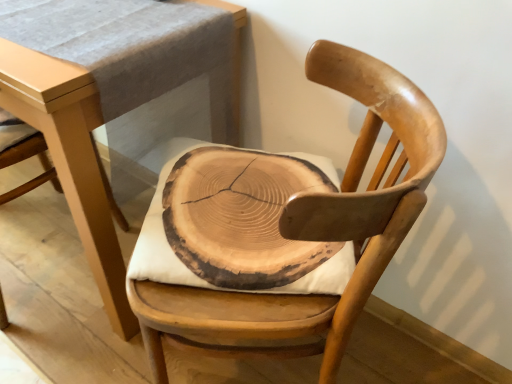
Question: Is light brown wood table at center facing towards natural wood chair at center?

Choices:
 (A) yes
 (B) no

Answer: (B)

Question: From the image's perspective, is light brown wood table at center on top of natural wood chair at center?

Choices:
 (A) no
 (B) yes

Answer: (B)

Question: From the image's perspective, is light brown wood table at center under natural wood chair at center?

Choices:
 (A) no
 (B) yes

Answer: (A)

Question: Is light brown wood table at center positioned with its back to natural wood chair at center?

Choices:
 (A) no
 (B) yes

Answer: (A)

Question: Is light brown wood table at center to the right of natural wood chair at center from the viewer's perspective?

Choices:
 (A) no
 (B) yes

Answer: (A)

Question: Does light brown wood table at center have a greater height compared to natural wood chair at center?

Choices:
 (A) no
 (B) yes

Answer: (A)

Question: Is natural wood chair at center surrounding wooden slice cushion at center?

Choices:
 (A) yes
 (B) no

Answer: (A)

Question: Is natural wood chair at center further to camera compared to wooden slice cushion at center?

Choices:
 (A) yes
 (B) no

Answer: (B)

Question: Is natural wood chair at center smaller than wooden slice cushion at center?

Choices:
 (A) yes
 (B) no

Answer: (B)

Question: Is natural wood chair at center taller than wooden slice cushion at center?

Choices:
 (A) no
 (B) yes

Answer: (B)

Question: Are natural wood chair at center and wooden slice cushion at center located far from each other?

Choices:
 (A) yes
 (B) no

Answer: (B)

Question: Considering the relative sizes of natural wood chair at center and wooden slice cushion at center in the image provided, is natural wood chair at center thinner than wooden slice cushion at center?

Choices:
 (A) no
 (B) yes

Answer: (A)

Question: Does wooden slice cushion at center lie in front of light brown wood table at center?

Choices:
 (A) yes
 (B) no

Answer: (B)